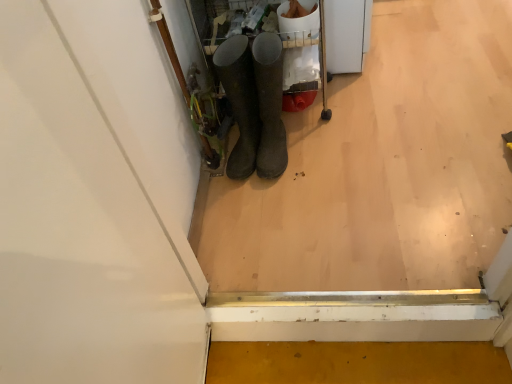
The image size is (512, 384). Find the location of `vacant area that is in front of dark brown rubber boots at center`. vacant area that is in front of dark brown rubber boots at center is located at coordinates (293, 200).